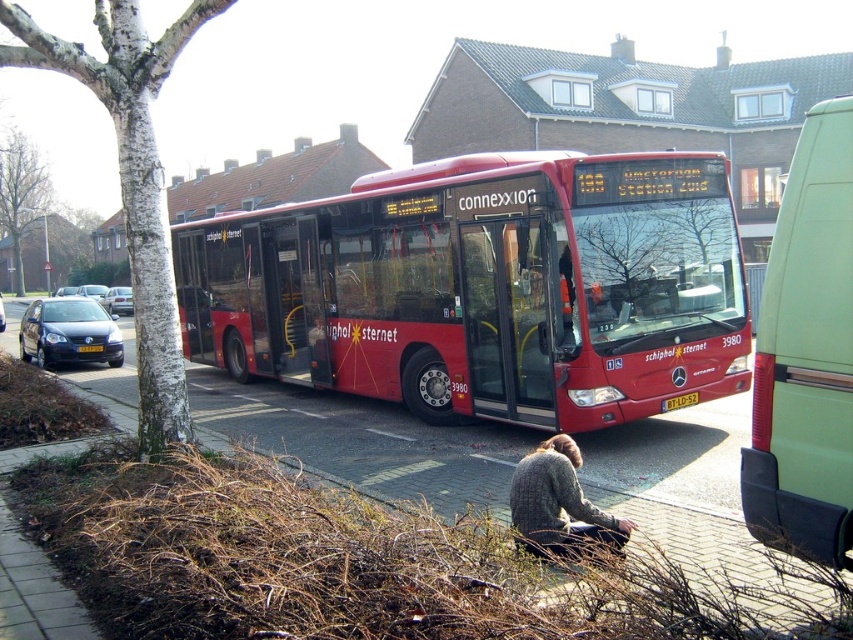
Who is shorter, brick pavement at lower center or knitted sweater at lower center?

brick pavement at lower center is shorter.

Who is lower down, brick pavement at lower center or knitted sweater at lower center?

knitted sweater at lower center is below.

The width and height of the screenshot is (853, 640). Find the location of `brick pavement at lower center`. brick pavement at lower center is located at coordinates (363, 442).

I want to click on brick pavement at lower center, so click(363, 442).

Measure the distance between red matte bus at center and camera.

red matte bus at center and camera are 25.08 feet apart.

This screenshot has height=640, width=853. Identify the location of red matte bus at center. (485, 289).

Does white bark tree at left have a lesser width compared to knitted sweater at lower center?

No, white bark tree at left is not thinner than knitted sweater at lower center.

This screenshot has height=640, width=853. Describe the element at coordinates (131, 179) in the screenshot. I see `white bark tree at left` at that location.

Which is behind, point (143, 48) or point (515, 484)?

The point (143, 48) is more distant.

Where is `white bark tree at left`? The height and width of the screenshot is (640, 853). white bark tree at left is located at coordinates (131, 179).